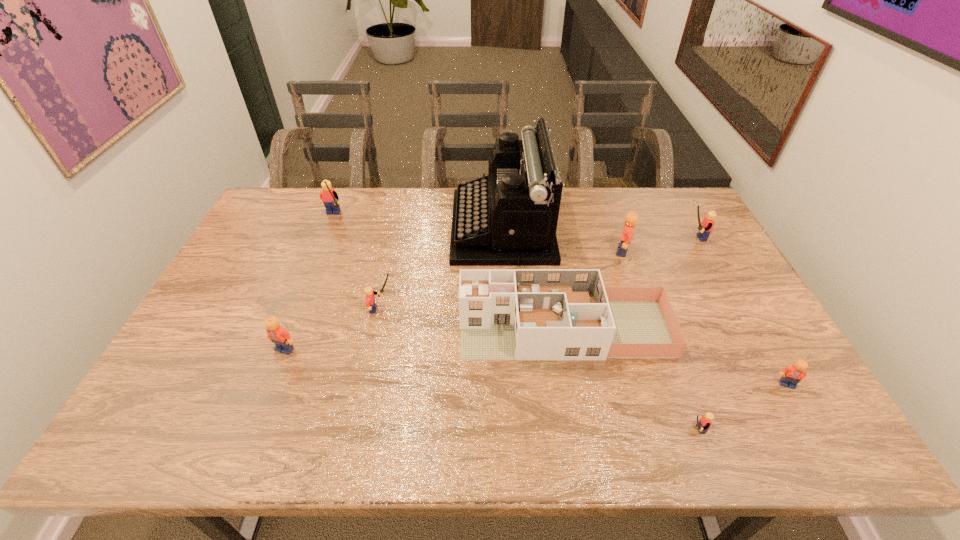
The width and height of the screenshot is (960, 540). Identify the location of object that is the sixth nearest to the leftmost orange Lego. (631, 218).

I want to click on the fifth closest object to the second nearest yellow Lego, so click(x=631, y=218).

The image size is (960, 540). I want to click on the third closest Lego to the third yellow Lego from left to right, so click(705, 227).

Locate which Lego ranks sixth in proximity to the fourth farthest Lego. Please provide its 2D coordinates. Your answer should be formatted as a tuple, i.e. [(x, y)], where the tuple contains the x and y coordinates of a point satisfying the conditions above.

[(792, 375)]

Identify which yellow Lego is the nearest to the farthest orange Lego. Please provide its 2D coordinates. Your answer should be formatted as a tuple, i.e. [(x, y)], where the tuple contains the x and y coordinates of a point satisfying the conditions above.

[(705, 227)]

The height and width of the screenshot is (540, 960). Identify the location of yellow Lego that is the third closest to the second nearest orange Lego. (704, 423).

Where is `orange Lego that is the closest to the second nearest orange Lego`? orange Lego that is the closest to the second nearest orange Lego is located at coordinates (631, 218).

Locate an element on the screen. The image size is (960, 540). orange Lego that is the second closest one to the dollhouse is located at coordinates (792, 375).

Find the location of a particular element. The height and width of the screenshot is (540, 960). free space that satisfies the following two spatial constraints: 1. on the front-facing side of the second smallest yellow Lego; 2. on the front-facing side of the third nearest Lego is located at coordinates (372, 349).

I want to click on free region that satisfies the following two spatial constraints: 1. on the front-facing side of the fourth nearest Lego; 2. on the front-facing side of the third nearest Lego, so click(x=372, y=349).